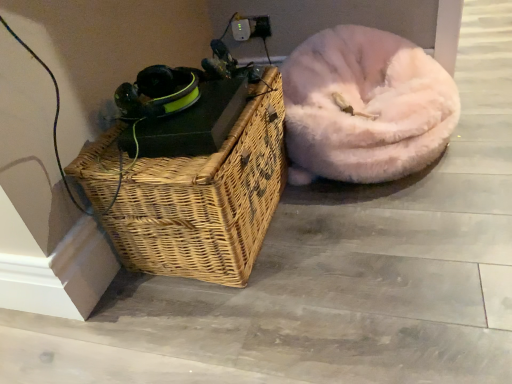
You are a GUI agent. You are given a task and a screenshot of the screen. Output one action in this format:
    pyautogui.click(x=<x>, y=<y>)
    Task: Click on the woven wood picnic basket at lower left
    The width and height of the screenshot is (512, 384).
    Given the screenshot: What is the action you would take?
    pyautogui.click(x=206, y=199)

What do you see at coordinates (206, 199) in the screenshot?
I see `woven wood picnic basket at lower left` at bounding box center [206, 199].

Locate an element on the screen. The height and width of the screenshot is (384, 512). fuzzy pink dog bed at right is located at coordinates (365, 107).

What do you see at coordinates (365, 107) in the screenshot? I see `fuzzy pink dog bed at right` at bounding box center [365, 107].

Find the location of a particular element. This screenshot has width=512, height=384. woven wood picnic basket at lower left is located at coordinates (206, 199).

Looking at this image, visually, is fuzzy pink dog bed at right positioned to the left or to the right of woven wood picnic basket at lower left?

From the image, it's evident that fuzzy pink dog bed at right is to the right of woven wood picnic basket at lower left.

Which object is closer to the camera taking this photo, fuzzy pink dog bed at right or woven wood picnic basket at lower left?

woven wood picnic basket at lower left.

Which is in front, point (376, 149) or point (128, 268)?

Positioned in front is point (128, 268).

Looking at this image, from the image's perspective, is fuzzy pink dog bed at right under woven wood picnic basket at lower left?

No.

From a real-world perspective, is fuzzy pink dog bed at right above or below woven wood picnic basket at lower left?

In terms of real-world spatial position, fuzzy pink dog bed at right is below woven wood picnic basket at lower left.

Which object is wider, fuzzy pink dog bed at right or woven wood picnic basket at lower left?

fuzzy pink dog bed at right is wider.

In the scene shown: Considering the sizes of fuzzy pink dog bed at right and woven wood picnic basket at lower left in the image, is fuzzy pink dog bed at right taller or shorter than woven wood picnic basket at lower left?

Clearly, fuzzy pink dog bed at right is shorter compared to woven wood picnic basket at lower left.

Based on their sizes in the image, would you say fuzzy pink dog bed at right is bigger or smaller than woven wood picnic basket at lower left?

In the image, fuzzy pink dog bed at right appears to be larger than woven wood picnic basket at lower left.

Is fuzzy pink dog bed at right not within woven wood picnic basket at lower left?

Yes, fuzzy pink dog bed at right is located beyond the bounds of woven wood picnic basket at lower left.

Is fuzzy pink dog bed at right touching woven wood picnic basket at lower left?

No, fuzzy pink dog bed at right is not touching woven wood picnic basket at lower left.

Is fuzzy pink dog bed at right facing away from woven wood picnic basket at lower left?

fuzzy pink dog bed at right does not have its back to woven wood picnic basket at lower left.

The image size is (512, 384). Identify the location of dog bed lying behind the woven wood picnic basket at lower left. (365, 107).

Between woven wood picnic basket at lower left and fuzzy pink dog bed at right, which one appears on the right side from the viewer's perspective?

fuzzy pink dog bed at right is more to the right.

Is woven wood picnic basket at lower left in front of fuzzy pink dog bed at right?

Yes, woven wood picnic basket at lower left is closer to the viewer.

Considering the positions of point (133, 194) and point (305, 124), is point (133, 194) closer or farther from the camera than point (305, 124)?

Point (133, 194).

From the image's perspective, between woven wood picnic basket at lower left and fuzzy pink dog bed at right, which one is located above?

From the image's view, fuzzy pink dog bed at right is above.

Based on the photo, from a real-world perspective, between woven wood picnic basket at lower left and fuzzy pink dog bed at right, who is vertically higher?

woven wood picnic basket at lower left is physically above.

Between woven wood picnic basket at lower left and fuzzy pink dog bed at right, which one has larger width?

fuzzy pink dog bed at right is wider.

Based on the photo, which of these two, woven wood picnic basket at lower left or fuzzy pink dog bed at right, stands shorter?

Standing shorter between the two is fuzzy pink dog bed at right.

Who is smaller, woven wood picnic basket at lower left or fuzzy pink dog bed at right?

woven wood picnic basket at lower left.

Would you say woven wood picnic basket at lower left contains fuzzy pink dog bed at right?

Actually, fuzzy pink dog bed at right is outside woven wood picnic basket at lower left.

Is woven wood picnic basket at lower left next to fuzzy pink dog bed at right and touching it?

No, woven wood picnic basket at lower left is not making contact with fuzzy pink dog bed at right.

Is woven wood picnic basket at lower left oriented towards fuzzy pink dog bed at right?

No, woven wood picnic basket at lower left is not facing towards fuzzy pink dog bed at right.

Where is `picnic basket on the left of fuzzy pink dog bed at right`? The width and height of the screenshot is (512, 384). picnic basket on the left of fuzzy pink dog bed at right is located at coordinates (206, 199).

You are a GUI agent. You are given a task and a screenshot of the screen. Output one action in this format:
    pyautogui.click(x=<x>, y=<y>)
    Task: Click on the picnic basket that appears below the fuzzy pink dog bed at right (from the image's perspective)
    
    Given the screenshot: What is the action you would take?
    pyautogui.click(x=206, y=199)

Find the location of a particular element. The height and width of the screenshot is (384, 512). picnic basket that is in front of the fuzzy pink dog bed at right is located at coordinates (206, 199).